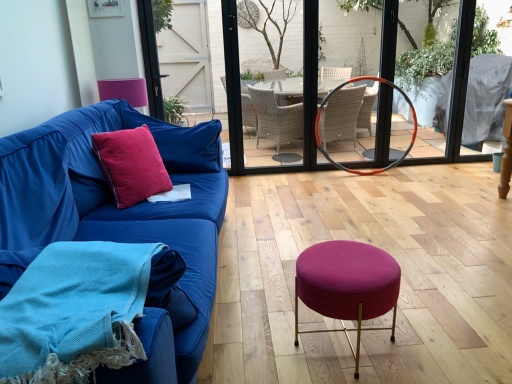
Question: Can you confirm if velvet cushion at left is positioned to the right of orange rubber hula hoop at center?

Choices:
 (A) yes
 (B) no

Answer: (B)

Question: Is velvet cushion at left not close to orange rubber hula hoop at center?

Choices:
 (A) yes
 (B) no

Answer: (A)

Question: From the image's perspective, would you say velvet cushion at left is positioned over orange rubber hula hoop at center?

Choices:
 (A) no
 (B) yes

Answer: (A)

Question: Does velvet cushion at left have a greater height compared to orange rubber hula hoop at center?

Choices:
 (A) no
 (B) yes

Answer: (A)

Question: Can you confirm if velvet cushion at left is shorter than orange rubber hula hoop at center?

Choices:
 (A) no
 (B) yes

Answer: (B)

Question: Is velvet cushion at left turned away from orange rubber hula hoop at center?

Choices:
 (A) yes
 (B) no

Answer: (B)

Question: Is velvet magenta stool at center positioned behind woolen blue blanket at lower left?

Choices:
 (A) yes
 (B) no

Answer: (A)

Question: Does velvet magenta stool at center come in front of woolen blue blanket at lower left?

Choices:
 (A) no
 (B) yes

Answer: (A)

Question: Does velvet magenta stool at center appear on the left side of woolen blue blanket at lower left?

Choices:
 (A) no
 (B) yes

Answer: (A)

Question: Considering the relative sizes of velvet magenta stool at center and woolen blue blanket at lower left in the image provided, is velvet magenta stool at center wider than woolen blue blanket at lower left?

Choices:
 (A) yes
 (B) no

Answer: (B)

Question: From the image's perspective, is velvet magenta stool at center under woolen blue blanket at lower left?

Choices:
 (A) yes
 (B) no

Answer: (A)

Question: Does velvet magenta stool at center have a smaller size compared to woolen blue blanket at lower left?

Choices:
 (A) yes
 (B) no

Answer: (B)

Question: Is orange rubber hula hoop at center further to the viewer compared to pink velvet armchair at upper left?

Choices:
 (A) yes
 (B) no

Answer: (A)